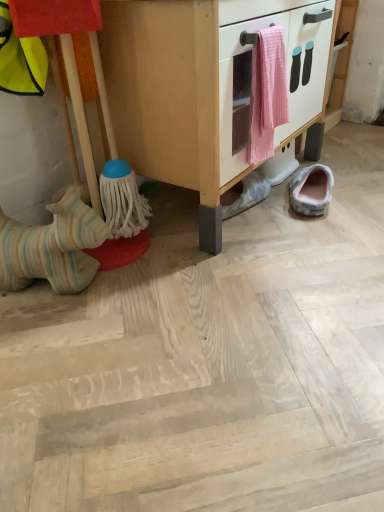
Question: Is pink woven towel at center inside or outside of wooden cabinet at center?

Choices:
 (A) inside
 (B) outside

Answer: (B)

Question: Based on their positions, is pink woven towel at center located to the left or right of wooden cabinet at center?

Choices:
 (A) left
 (B) right

Answer: (B)

Question: Which of these objects is positioned closest to the light pink fabric slipper at lower right, the first footwear positioned from the right?

Choices:
 (A) white fabric slipper at lower center, the 2th footwear positioned from the left
 (B) striped fabric horse at left
 (C) striped fabric toy at lower left, the first footwear viewed from the left
 (D) wooden cabinet at center
 (E) pink woven towel at center

Answer: (A)

Question: Estimate the real-world distances between objects in this image. Which object is closer to the light pink fabric slipper at lower right, positioned as the 3th footwear in left-to-right order?

Choices:
 (A) wooden cabinet at center
 (B) striped fabric toy at lower left, the first footwear viewed from the left
 (C) pink woven towel at center
 (D) white fabric slipper at lower center, the 2th footwear positioned from the left
 (E) striped fabric horse at left

Answer: (D)